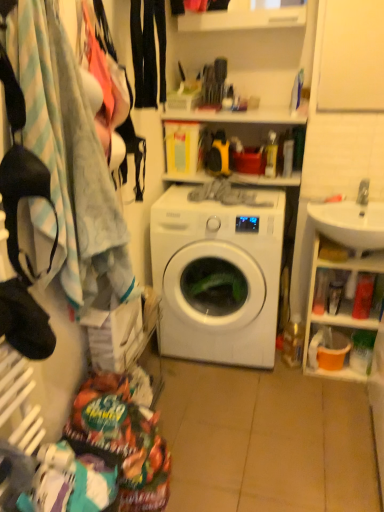
Question: Does white glossy sink at right have a smaller size compared to white glossy cabinet at right?

Choices:
 (A) yes
 (B) no

Answer: (A)

Question: Would you say white glossy cabinet at right is part of white glossy sink at right's contents?

Choices:
 (A) yes
 (B) no

Answer: (B)

Question: From the image's perspective, would you say white glossy sink at right is shown under white glossy cabinet at right?

Choices:
 (A) no
 (B) yes

Answer: (A)

Question: Is white glossy sink at right shorter than white glossy cabinet at right?

Choices:
 (A) yes
 (B) no

Answer: (A)

Question: Would you say white glossy sink at right is a long distance from white glossy cabinet at right?

Choices:
 (A) yes
 (B) no

Answer: (B)

Question: Can you confirm if white glossy sink at right is taller than white glossy cabinet at right?

Choices:
 (A) no
 (B) yes

Answer: (A)

Question: Can you confirm if white glossy washing machine at center is thinner than white glossy cabinet at right?

Choices:
 (A) no
 (B) yes

Answer: (A)

Question: Is white glossy washing machine at center bigger than white glossy cabinet at right?

Choices:
 (A) no
 (B) yes

Answer: (B)

Question: Does white glossy washing machine at center have a lesser height compared to white glossy cabinet at right?

Choices:
 (A) no
 (B) yes

Answer: (A)

Question: Would you say white glossy washing machine at center is a long distance from white glossy cabinet at right?

Choices:
 (A) no
 (B) yes

Answer: (A)

Question: Are white glossy washing machine at center and white glossy cabinet at right beside each other?

Choices:
 (A) no
 (B) yes

Answer: (A)

Question: Is white glossy washing machine at center surrounding white glossy cabinet at right?

Choices:
 (A) no
 (B) yes

Answer: (A)

Question: Does white glossy cabinet at right have a smaller size compared to white glossy washing machine at center?

Choices:
 (A) yes
 (B) no

Answer: (A)